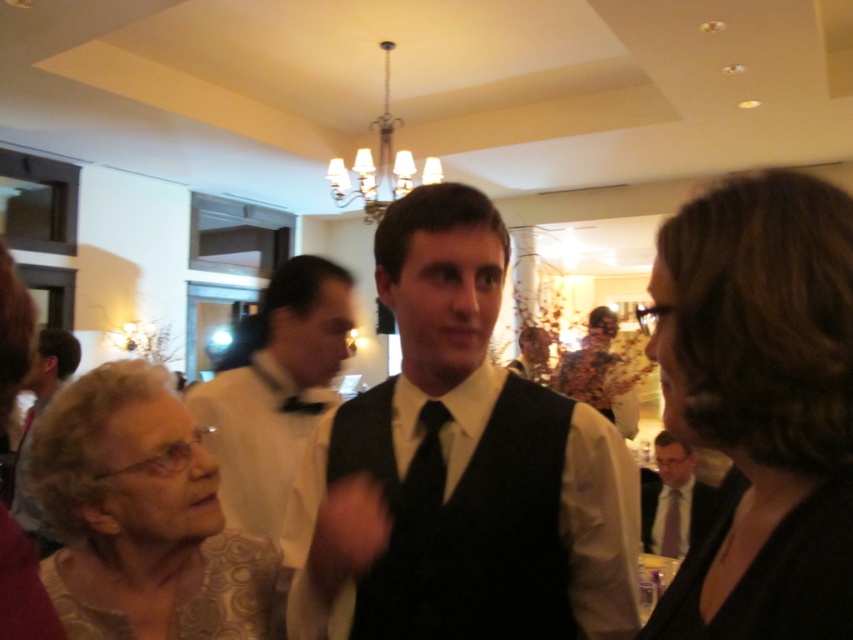
In the scene described, there is a point labeled at coordinates (x=761, y=403). Based on the description provided, what object or feature does this point correspond to?

The point at coordinates (x=761, y=403) corresponds to the dark brown hair at upper right.

You are a photographer at the event and need to adjust the camera focus. Which object, the dark brown hair at upper right or the matte black tie at center, should you focus on first if you want to capture the subject closest to the camera?

The dark brown hair at upper right is much taller than the matte black tie at center, so you should focus on the dark brown hair at upper right first since it is closer to the camera.